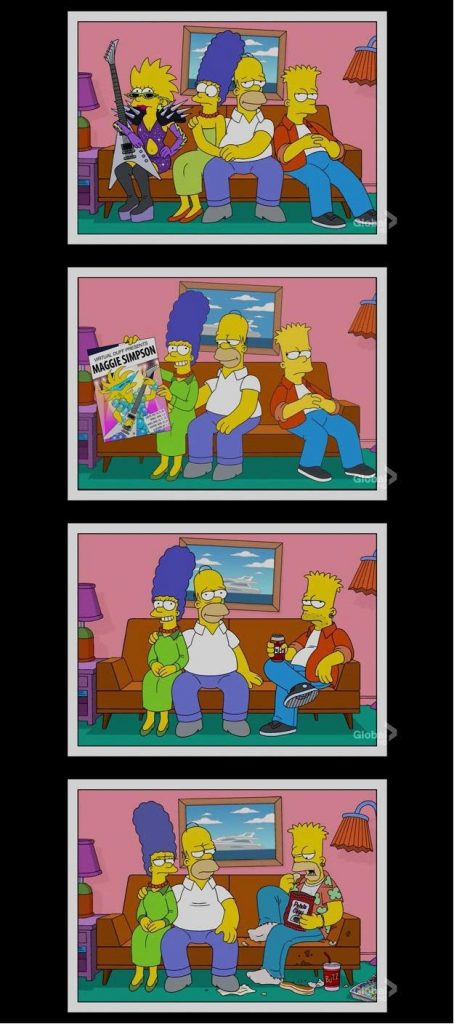
At what (x,y) coordinates should I click in order to perform the action: click on painting. Please return your answer as a coordinate pair (x, y). This screenshot has width=454, height=1024. Looking at the image, I should click on (232, 827), (232, 563), (227, 301), (253, 42).